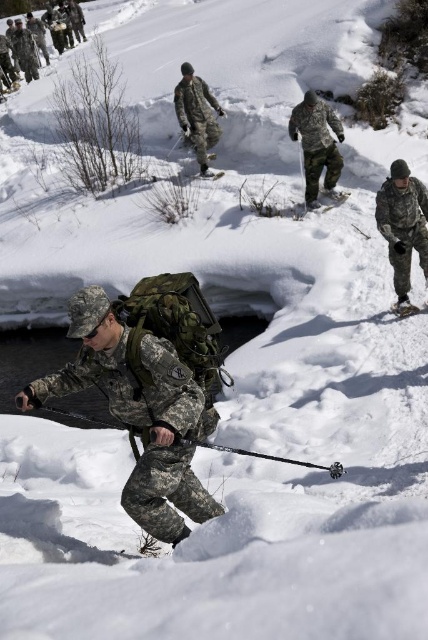
Question: Which of the following is the farthest from the observer?

Choices:
 (A) matte black ski at lower right
 (B) camouflage fabric backpack at center

Answer: (A)

Question: Which point is closer to the camera taking this photo?

Choices:
 (A) (187, 376)
 (B) (214, 120)
 (C) (427, 200)

Answer: (A)

Question: Which point is farther from the camera taking this photo?

Choices:
 (A) (95, 346)
 (B) (330, 170)
 (C) (229, 451)
 (D) (192, 120)

Answer: (D)

Question: Can you confirm if matte black ski at center is positioned to the right of black matte ski at center?

Choices:
 (A) yes
 (B) no

Answer: (A)

Question: Can you confirm if camouflage fabric backpack at center is smaller than matte black ski pole at center?

Choices:
 (A) yes
 (B) no

Answer: (B)

Question: Does matte black ski at center have a larger size compared to black matte ski at center?

Choices:
 (A) yes
 (B) no

Answer: (A)